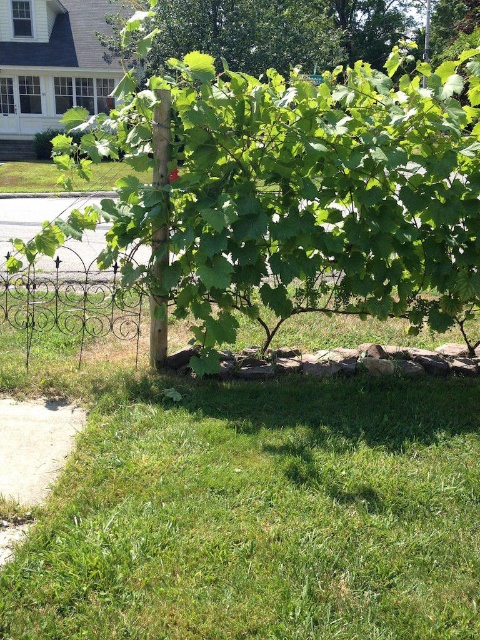
From the picture: You are a gardener who needs to water the green grass at lower left and the green leafy tree at center. The watering can you have can hold enough water to cover an area within a 3 meter radius. Starting from the tree, can you water both areas without moving the watering can?

The green grass at lower left is 3.34 meters away from the green leafy tree at center. Since the watering can covers up to 3 meters, the distance between them is slightly beyond the can range. Therefore, you cannot water both areas without moving the can.

You are standing at the center of the garden and want to walk to the wooden post supporting the grapevine. Which direction should you move relative to the green grass at lower left?

The green grass at lower left is located at point (257, 513), so you should move towards the upper right direction to reach the wooden post supporting the grapevine.

You are standing in the garden and want to walk from the green grass at lower left to the green leafy tree at center. Which direction should you move to reach the tree?

You should move to the right from the green grass at lower left to reach the green leafy tree at center because the green grass at lower left is positioned on the left side of the green leafy tree at center.